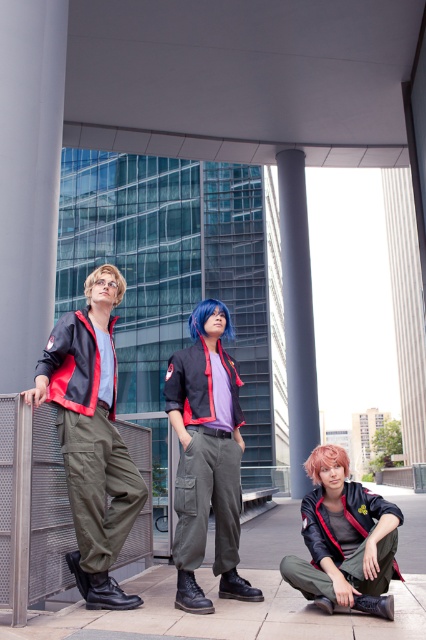
Is olive green cargo pants at left wider than blue matte wig at center?

No, olive green cargo pants at left is not wider than blue matte wig at center.

Who is higher up, olive green cargo pants at left or blue matte wig at center?

Positioned higher is blue matte wig at center.

Is point (86, 410) positioned after point (227, 308)?

No, (86, 410) is in front of (227, 308).

This screenshot has height=640, width=426. In order to click on olive green cargo pants at left in this screenshot , I will do (x=89, y=442).

Which of these two, blue matte wig at center or blondehair at upper left, stands shorter?

blue matte wig at center is shorter.

Can you confirm if blue matte wig at center is thinner than blondehair at upper left?

Correct, blue matte wig at center's width is less than blondehair at upper left's.

Is point (213, 301) farther from camera compared to point (120, 275)?

No, (213, 301) is closer to viewer.

At what (x,y) coordinates should I click in order to perform the action: click on blue matte wig at center. Please return your answer as a coordinate pair (x, y). The height and width of the screenshot is (640, 426). Looking at the image, I should click on (207, 317).

Between matte black jacket at center and blue matte wig at center, which one is positioned lower?

matte black jacket at center

Between matte black jacket at center and blue matte wig at center, which one appears on the left side from the viewer's perspective?

blue matte wig at center is more to the left.

Is point (181, 552) closer to camera compared to point (196, 316)?

Yes.

Identify the location of matte black jacket at center. pos(203,465).